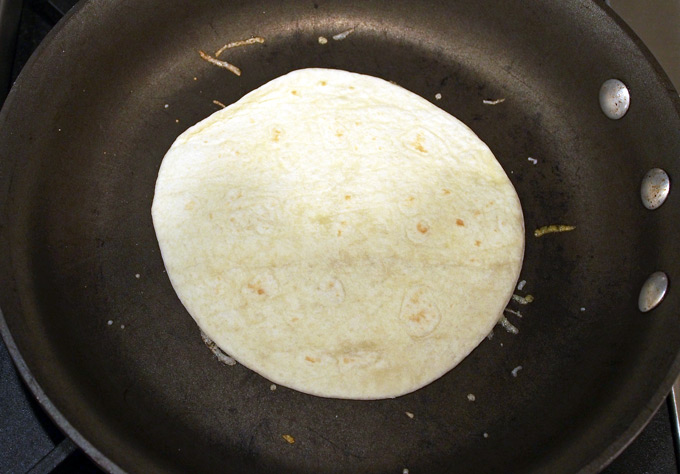
The height and width of the screenshot is (474, 680). I want to click on pan, so 112,236.